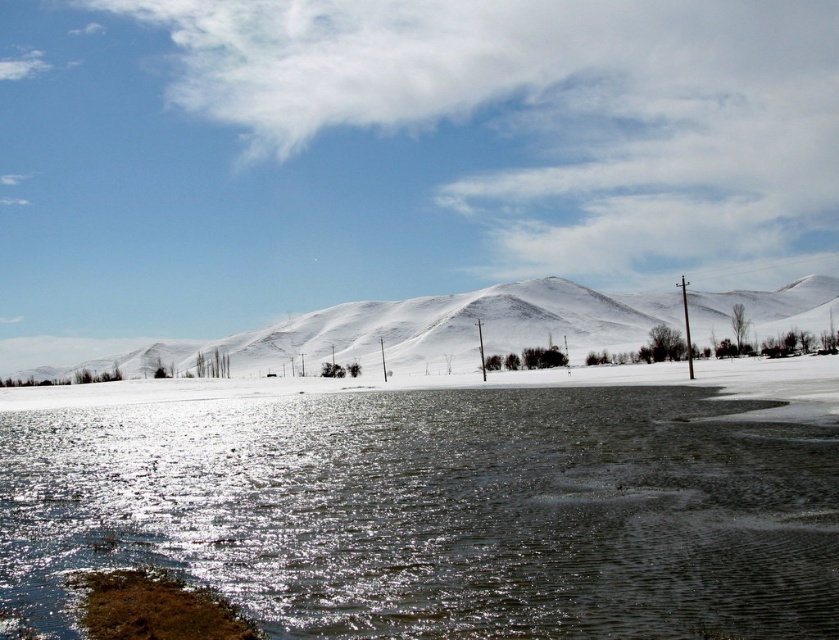
Question: Is translucent ice at lower center bigger than white snow-covered mountain at center?

Choices:
 (A) yes
 (B) no

Answer: (B)

Question: Among these points, which one is nearest to the camera?

Choices:
 (A) [168, 429]
 (B) [791, 289]

Answer: (A)

Question: Observing the image, what is the correct spatial positioning of translucent ice at lower center in reference to white snow-covered mountain at center?

Choices:
 (A) below
 (B) above

Answer: (A)

Question: Does translucent ice at lower center have a smaller size compared to white snow-covered mountain at center?

Choices:
 (A) yes
 (B) no

Answer: (A)